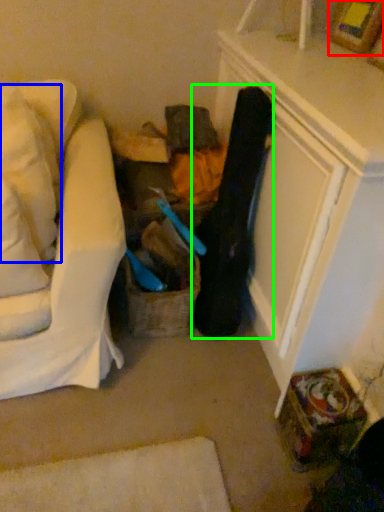
Question: Based on their relative distances, which object is farther from picture frame (highlighted by a red box)? Choose from pillow (highlighted by a blue box) and clothing (highlighted by a green box).

Choices:
 (A) pillow
 (B) clothing

Answer: (A)